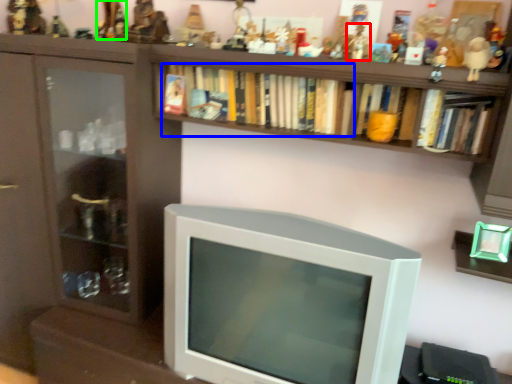
Question: Which object is the closest to the toy (highlighted by a red box)? Choose among these: book (highlighted by a blue box) or toy (highlighted by a green box).

Choices:
 (A) book
 (B) toy

Answer: (A)